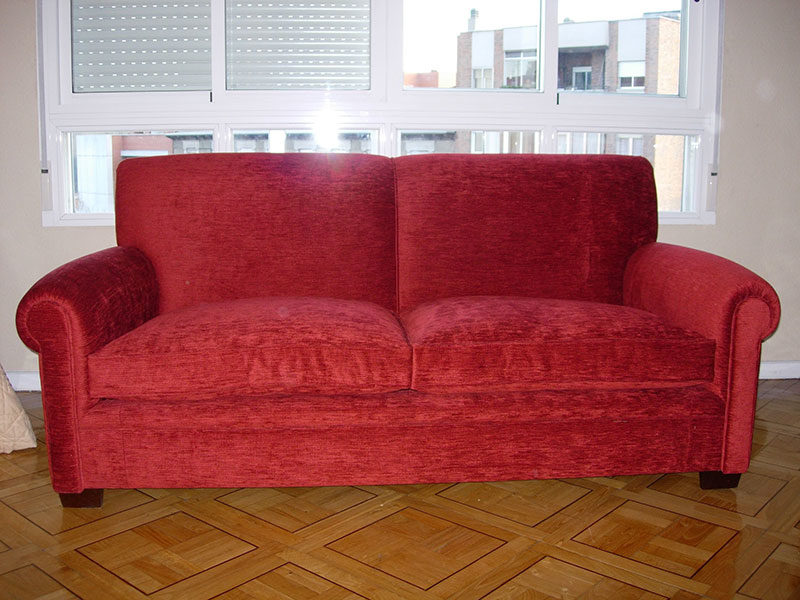
Identify the location of windows. (85, 149), (253, 135), (430, 139), (589, 137).